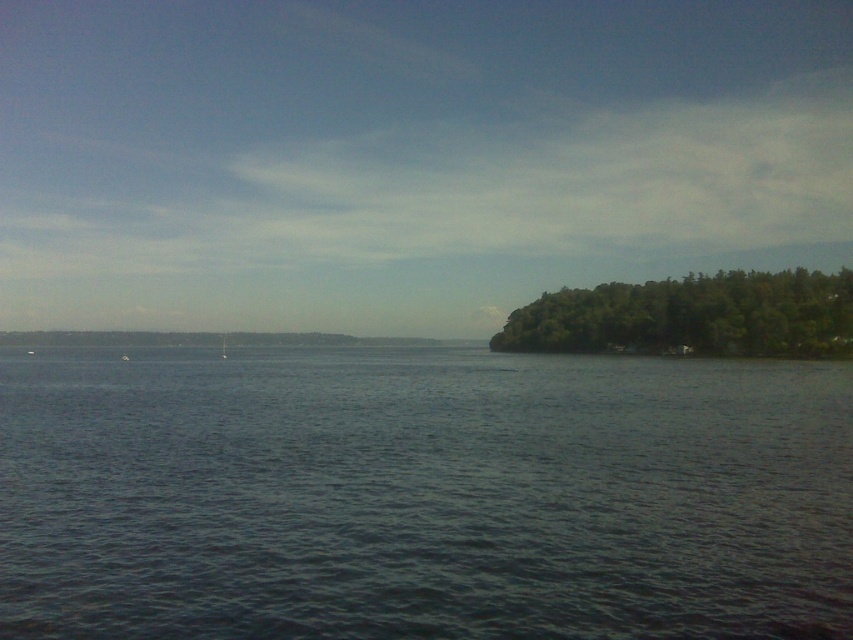
You are a boat captain planning to navigate through the dark blue water at center and the green leafy trees at right. Which area has a greater width for passage?

The dark blue water at center has a greater width than the green leafy trees at right, so the passage through the dark blue water at center is wider.

You are standing on the shore looking out at the water. You see the green leafy trees at right and the white matte boat at center. Which object is higher from your viewpoint?

The green leafy trees at right are higher from your viewpoint because they are positioned above the white matte boat at center in the image.

You are standing at the edge of the waterfront scene and want to place a small buoy at each of the two points labeled point (119, 554) and point (810, 330). Which point will appear larger in your view?

Point (119, 554) is closer to the viewer than point (810, 330), so the buoy placed at point (119, 554) will appear larger in your view.